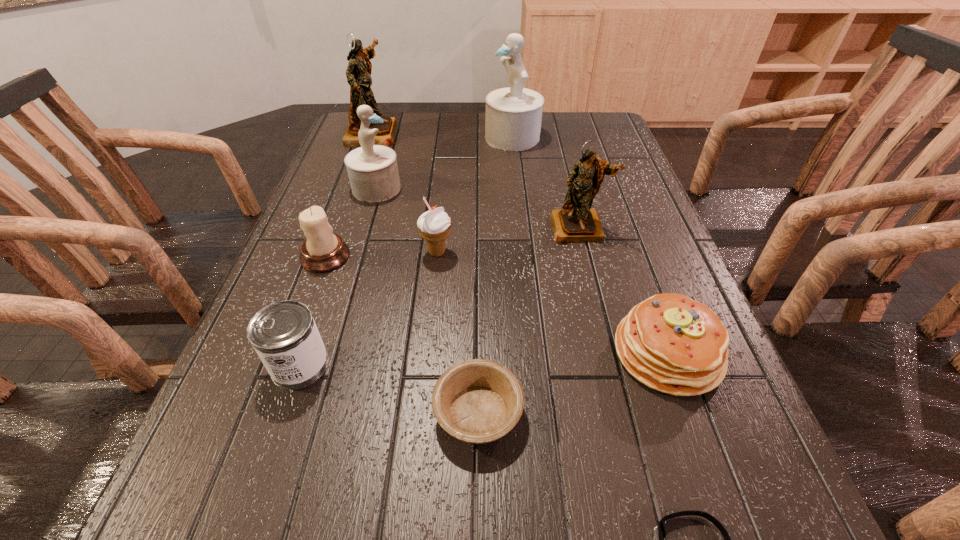
Find the location of `object that stands as the eighth closest to the pancake`. object that stands as the eighth closest to the pancake is located at coordinates (513, 117).

Identify which figurine is located as the second nearest to the left white figurine. Please provide its 2D coordinates. Your answer should be formatted as a tuple, i.e. [(x, y)], where the tuple contains the x and y coordinates of a point satisfying the conditions above.

[(513, 117)]

Identify the location of figurine that is the second nearest to the wristband. (373, 172).

The image size is (960, 540). In order to click on vacant space that satisfies the following two spatial constraints: 1. at the beak of the second nearest figurine; 2. on the front side of the white candle holder in this screenshot , I will do `click(356, 256)`.